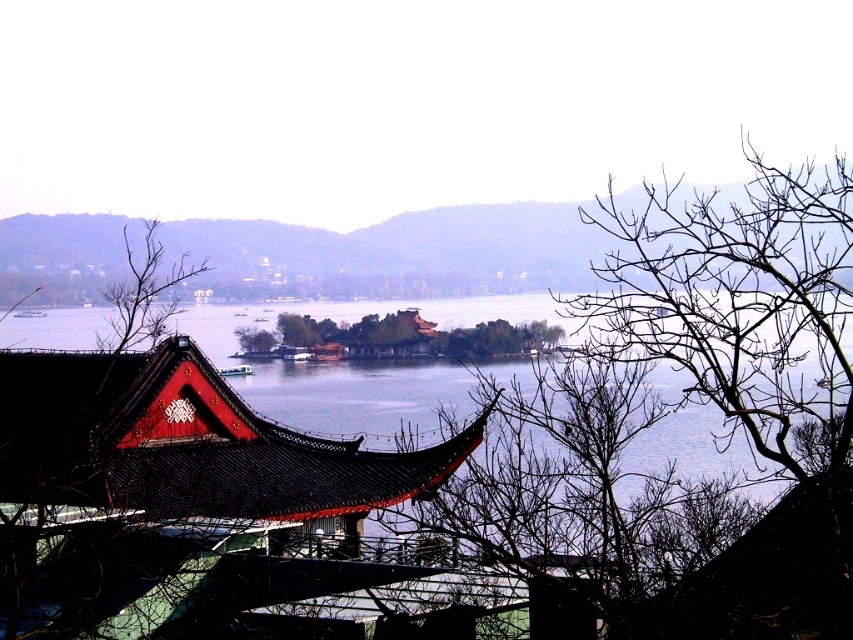
Who is lower down, green leafy island at center or brown leafless tree at center?

brown leafless tree at center is lower down.

Consider the image. Who is more distant from viewer, (450, 340) or (260, 339)?

Point (260, 339)

Where is `green leafy island at center`? The width and height of the screenshot is (853, 640). green leafy island at center is located at coordinates (399, 337).